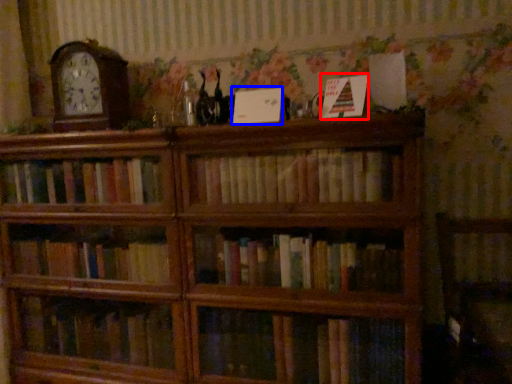
Question: Among these objects, which one is farthest to the camera, paperback book (highlighted by a red box) or paperback book (highlighted by a blue box)?

Choices:
 (A) paperback book
 (B) paperback book

Answer: (B)